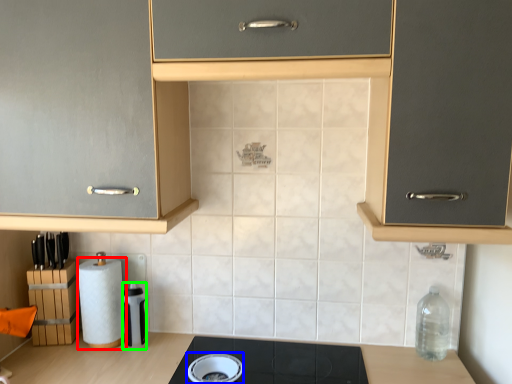
Question: Which is farther away from paper towel (highlighted by a red box)? appliance (highlighted by a blue box) or appliance (highlighted by a green box)?

Choices:
 (A) appliance
 (B) appliance

Answer: (A)